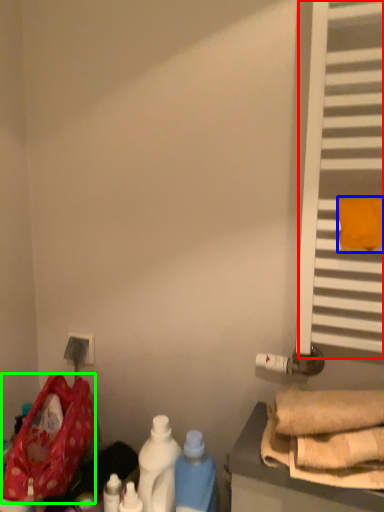
Question: Which object is the closest to the window (highlighted by a red box)? Choose among these: beach towel (highlighted by a blue box) or wide (highlighted by a green box).

Choices:
 (A) beach towel
 (B) wide

Answer: (A)